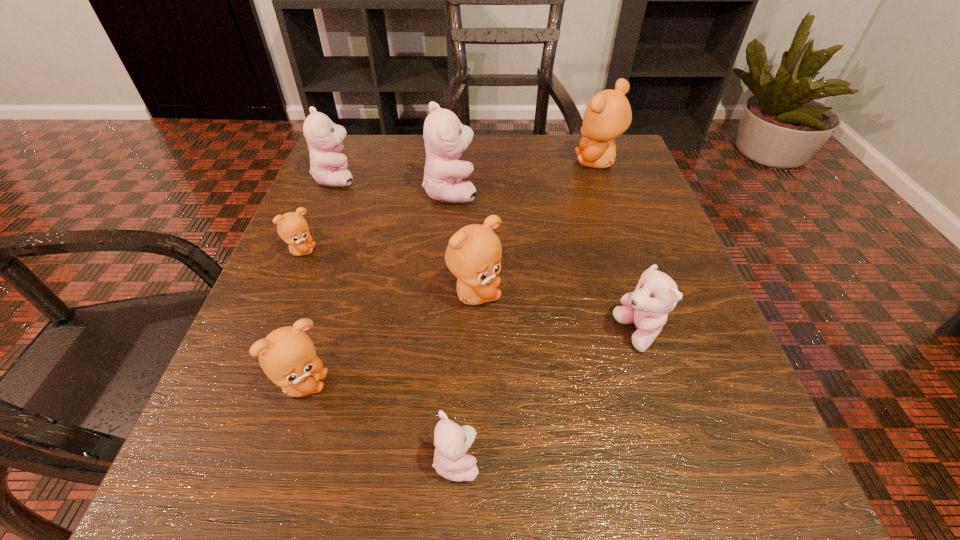
At what (x,y) coordinates should I click in order to perform the action: click on vacant space that is in between the rightmost pink teddy bear and the third farthest brown teddy bear. Please return your answer as a coordinate pair (x, y). The height and width of the screenshot is (540, 960). Looking at the image, I should click on (557, 314).

Locate an element on the screen. The width and height of the screenshot is (960, 540). free point between the fifth nearest teddy bear and the nearest teddy bear is located at coordinates (379, 355).

Image resolution: width=960 pixels, height=540 pixels. I want to click on free space between the nearest object and the biggest pink teddy bear, so click(453, 326).

At what (x,y) coordinates should I click in order to perform the action: click on the fifth closest object relative to the nearest pink teddy bear. Please return your answer as a coordinate pair (x, y). Looking at the image, I should click on (445, 137).

At what (x,y) coordinates should I click in order to perform the action: click on object that is the third closest one to the third biggest pink teddy bear. Please return your answer as a coordinate pair (x, y). Looking at the image, I should click on (445, 137).

This screenshot has width=960, height=540. I want to click on teddy bear that is the sixth closest to the nearest pink teddy bear, so click(x=328, y=166).

At what (x,y) coordinates should I click in order to perform the action: click on teddy bear identified as the closest to the third biggest brown teddy bear. Please return your answer as a coordinate pair (x, y). The height and width of the screenshot is (540, 960). Looking at the image, I should click on (452, 441).

Locate an element on the screen. the second closest pink teddy bear to the seventh farthest object is located at coordinates (445, 137).

Find the location of a particular element. The image size is (960, 540). pink teddy bear that stands as the fourth closest to the third brown teddy bear from right to left is located at coordinates (328, 166).

Locate an element on the screen. Image resolution: width=960 pixels, height=540 pixels. brown teddy bear that is the closest to the biggest brown teddy bear is located at coordinates (473, 255).